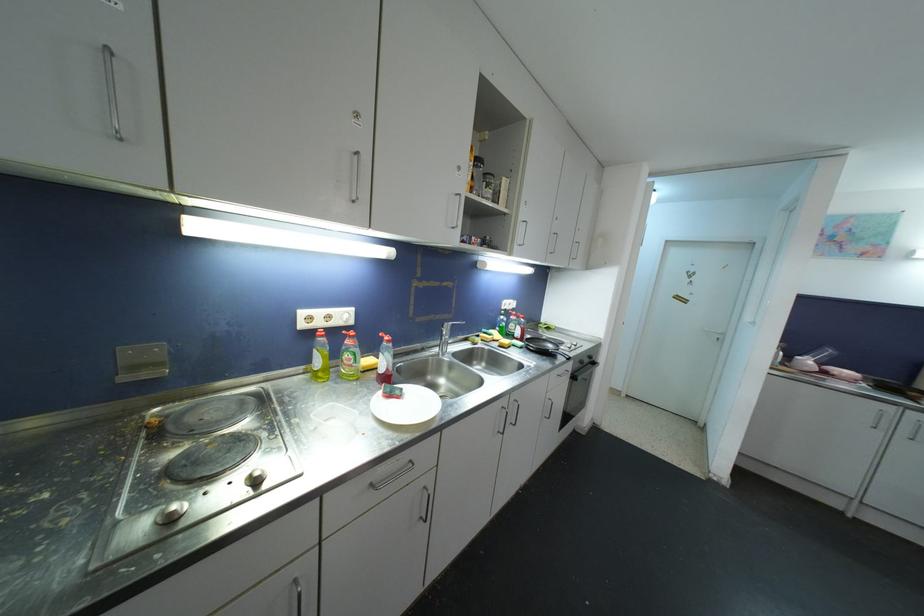
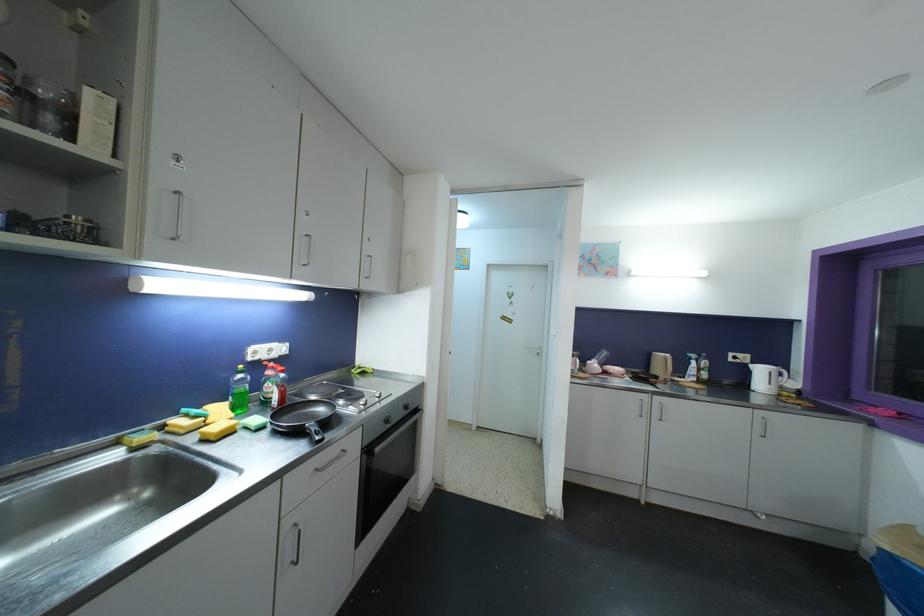
In the second image, find the point that corresponds to [526,321] in the first image.

(286, 374)